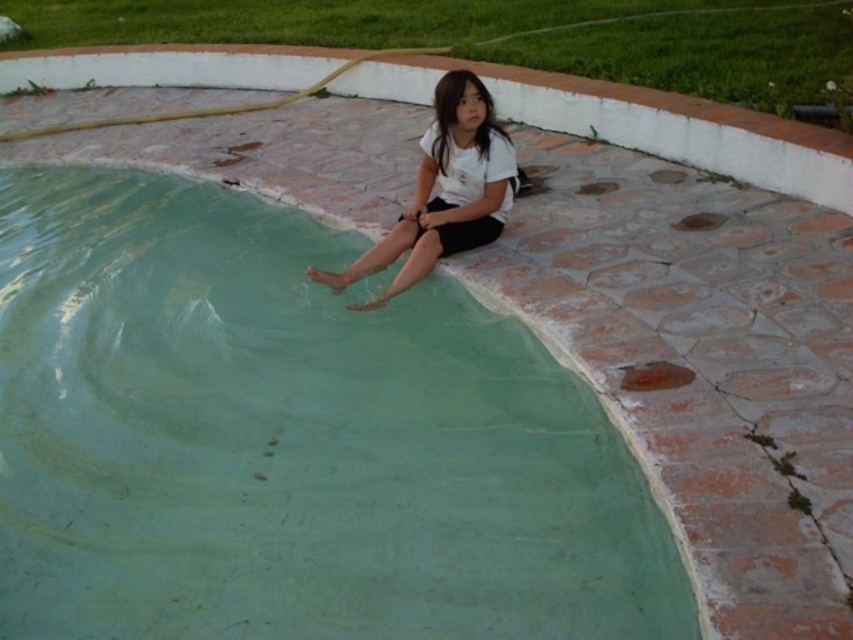
What do you see at coordinates (289, 440) in the screenshot?
I see `green concrete swimming pool at upper center` at bounding box center [289, 440].

Could you measure the distance between green concrete swimming pool at upper center and white matte shirt at upper center?

A distance of 97.93 centimeters exists between green concrete swimming pool at upper center and white matte shirt at upper center.

Image resolution: width=853 pixels, height=640 pixels. What do you see at coordinates (289, 440) in the screenshot? I see `green concrete swimming pool at upper center` at bounding box center [289, 440].

The image size is (853, 640). What are the coordinates of `green concrete swimming pool at upper center` in the screenshot? It's located at (289, 440).